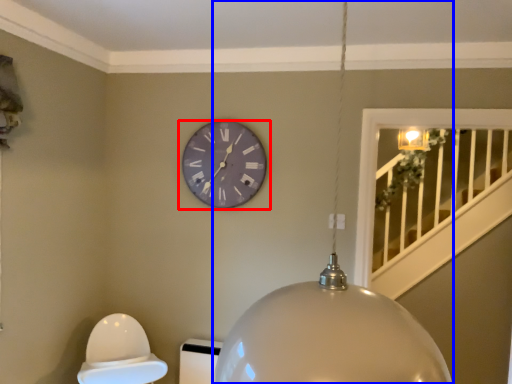
Question: Which point is closer to the camera, wall clock (highlighted by a red box) or lamp (highlighted by a blue box)?

Choices:
 (A) wall clock
 (B) lamp

Answer: (B)